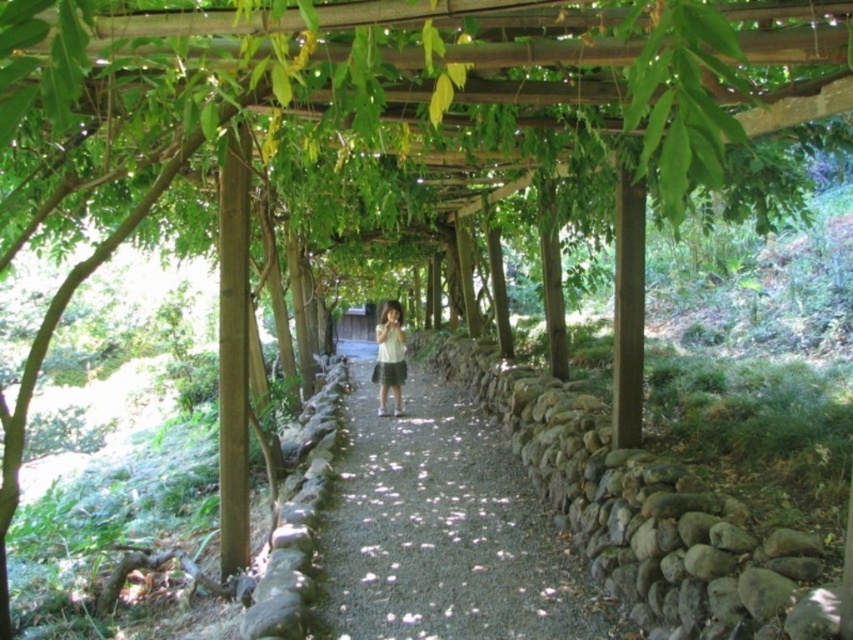
Is gravel path at center taller than white matte shirt at center?

Incorrect, gravel path at center's height is not larger of white matte shirt at center's.

Between gravel path at center and white matte shirt at center, which one has less height?

Standing shorter between the two is gravel path at center.

Is point (489, 609) positioned in front of point (402, 362)?

That is True.

Identify the location of gravel path at center. (444, 531).